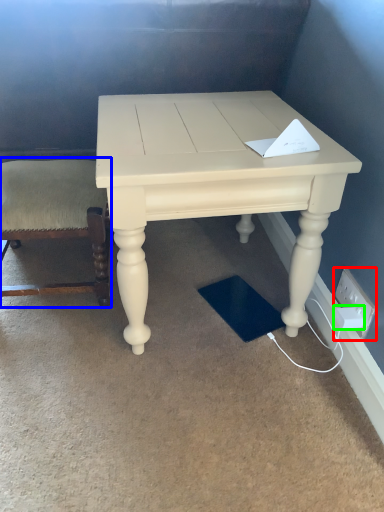
Question: Estimate the real-world distances between objects in this image. Which object is closer to electric outlet (highlighted by a red box), chair (highlighted by a blue box) or socket (highlighted by a green box)?

Choices:
 (A) chair
 (B) socket

Answer: (B)